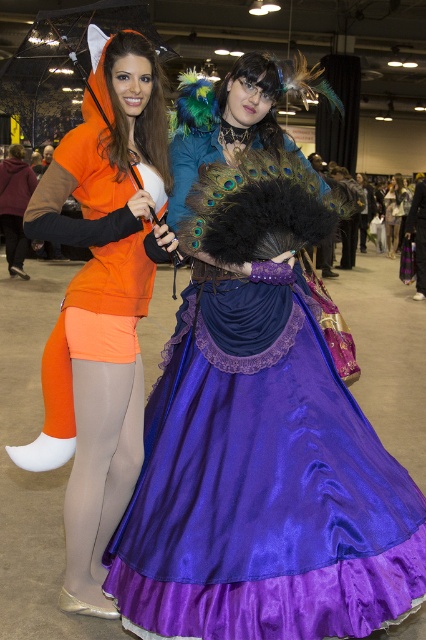
Question: Which point is farther to the camera?

Choices:
 (A) (112, 380)
 (B) (389, 193)
 (C) (408, 612)
 (D) (100, 10)

Answer: (B)

Question: Does matte orange hoodie at left appear over purple satin dress at center?

Choices:
 (A) no
 (B) yes

Answer: (A)

Question: Which point is farther to the camera?

Choices:
 (A) matte orange hoodie at left
 (B) transparent plastic umbrella at upper center

Answer: (A)

Question: Which point appears farthest from the camera in this image?

Choices:
 (A) pyautogui.click(x=43, y=22)
 (B) pyautogui.click(x=388, y=192)
 (C) pyautogui.click(x=80, y=200)
 (D) pyautogui.click(x=216, y=192)

Answer: (B)

Question: Does satin purple dress at center come behind transparent plastic umbrella at upper center?

Choices:
 (A) no
 (B) yes

Answer: (B)

Question: Is satin purple dress at center to the right of matte orange hoodie at left from the viewer's perspective?

Choices:
 (A) yes
 (B) no

Answer: (A)